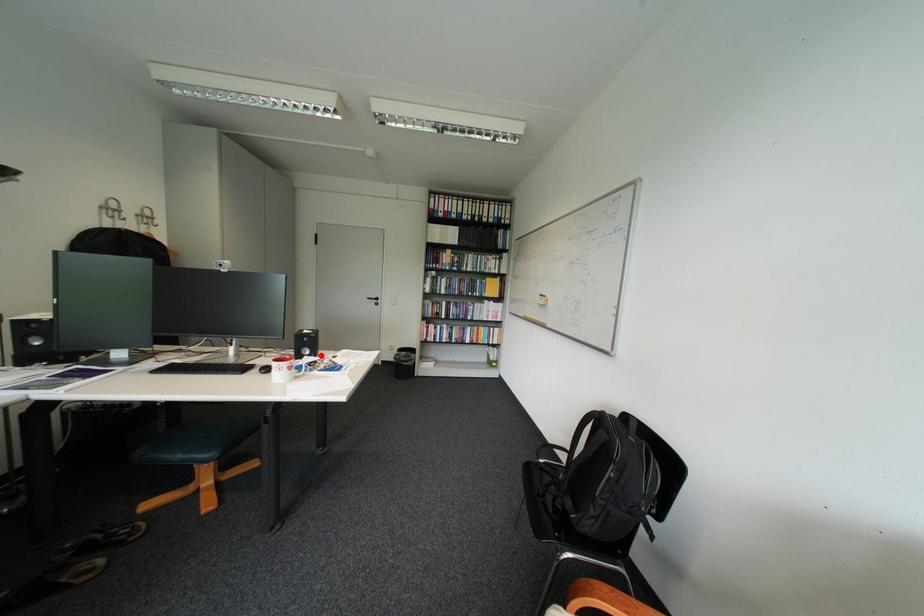
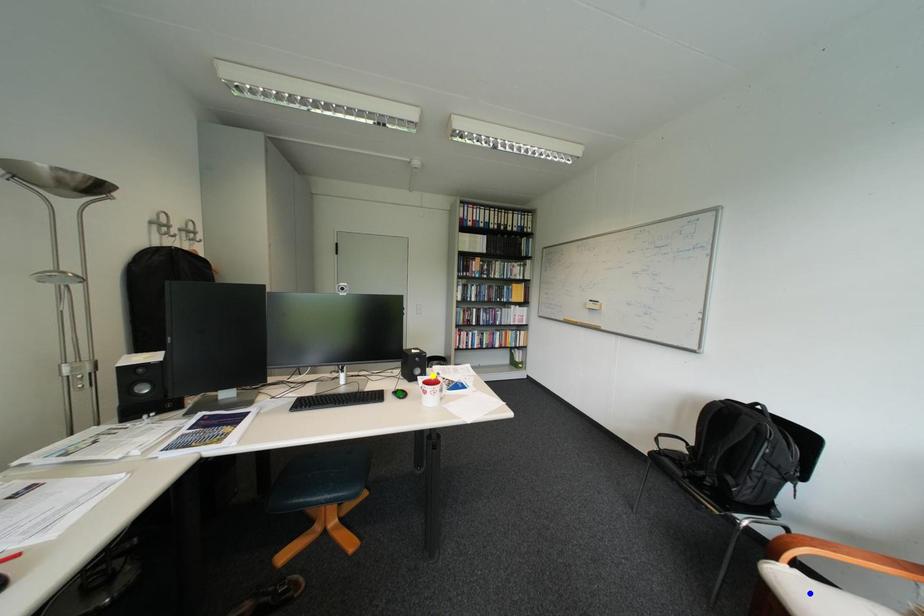
Question: I am providing you with two images of the same scene from different viewpoints. A red point is marked on the first image. You are given multiple points on the second image. In image 2, which mark is for the same physical point as the one in image 1?

Choices:
 (A) green point
 (B) yellow point
 (C) blue point

Answer: (B)